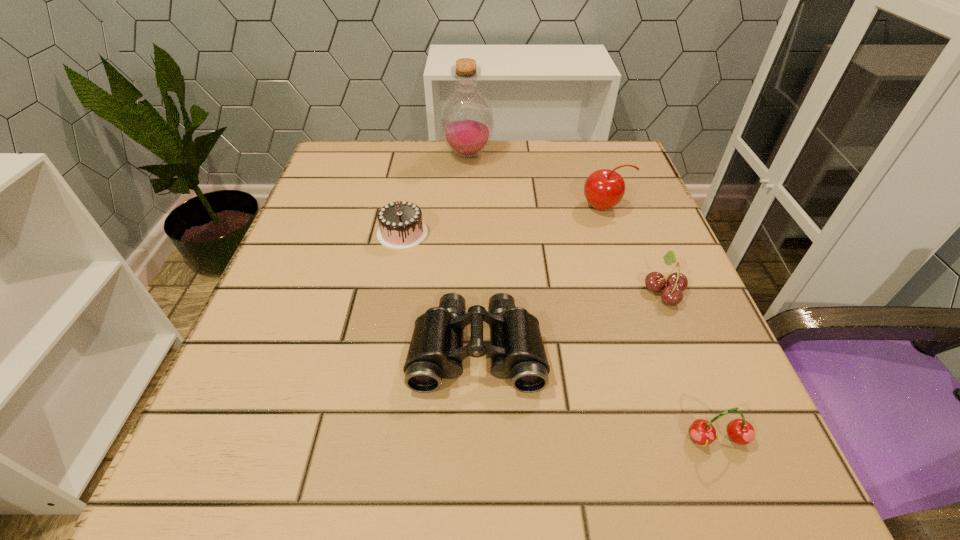
The height and width of the screenshot is (540, 960). Find the location of `vacant space situated 0.250m on the right of the chocolate cake`. vacant space situated 0.250m on the right of the chocolate cake is located at coordinates pyautogui.click(x=552, y=233).

Locate an element on the screen. free location located 0.090m on the front-facing side of the fifth farthest object is located at coordinates (476, 457).

Where is `free spot located on the leaves of the second farthest cherry`? This screenshot has height=540, width=960. free spot located on the leaves of the second farthest cherry is located at coordinates (433, 291).

The height and width of the screenshot is (540, 960). Identify the location of vacant position located on the leaves of the second farthest cherry. pyautogui.click(x=604, y=291).

This screenshot has height=540, width=960. Find the location of `vacant position located 0.150m on the leaves of the second farthest cherry`. vacant position located 0.150m on the leaves of the second farthest cherry is located at coordinates (558, 291).

The image size is (960, 540). What are the coordinates of `object at the far edge` in the screenshot? It's located at (466, 122).

What are the coordinates of `object positioned at the near edge` in the screenshot? It's located at (740, 431).

The height and width of the screenshot is (540, 960). Identify the location of object situated at the near right corner. (740, 431).

Locate an element on the screen. The image size is (960, 540). free space at the far edge of the desktop is located at coordinates (494, 171).

Image resolution: width=960 pixels, height=540 pixels. I want to click on free space at the left edge, so click(345, 225).